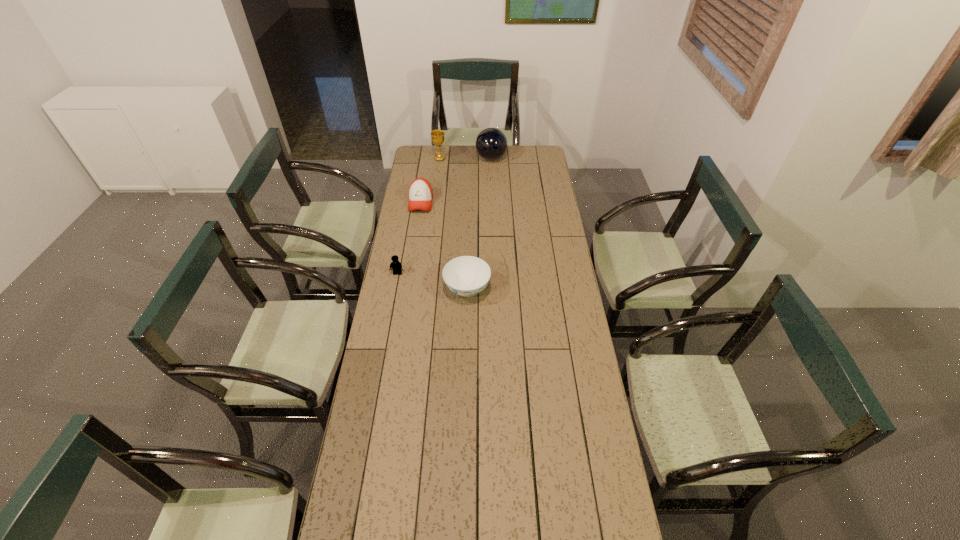
At what (x,y) coordinates should I click in order to perform the action: click on bowling ball. Please return your answer as a coordinate pair (x, y). The width and height of the screenshot is (960, 540). Looking at the image, I should click on (491, 143).

Locate an element on the screen. This screenshot has width=960, height=540. chalice is located at coordinates (437, 136).

Where is `the third farthest object`? The image size is (960, 540). the third farthest object is located at coordinates 420,192.

Where is `chinaware`? The image size is (960, 540). chinaware is located at coordinates (466, 276).

Find the location of a particular element. Image resolution: width=960 pixels, height=540 pixels. Lego is located at coordinates (396, 266).

At what (x,y) coordinates should I click in order to perform the action: click on vacant area situated on the side of the bowling ball with the finger holes. Please return your answer as a coordinate pair (x, y). This screenshot has height=540, width=960. Looking at the image, I should click on (413, 158).

Locate an element on the screen. The image size is (960, 540). free space located 0.160m on the side of the bowling ball with the finger holes is located at coordinates (447, 158).

Where is `free point located on the side of the bowling ball with the finger holes`? The width and height of the screenshot is (960, 540). free point located on the side of the bowling ball with the finger holes is located at coordinates (467, 158).

This screenshot has width=960, height=540. What are the coordinates of `vacant space located 0.230m on the right of the chalice` in the screenshot? It's located at (487, 159).

Locate an element on the screen. The width and height of the screenshot is (960, 540). free space located 0.320m on the front-facing side of the third farthest object is located at coordinates (412, 260).